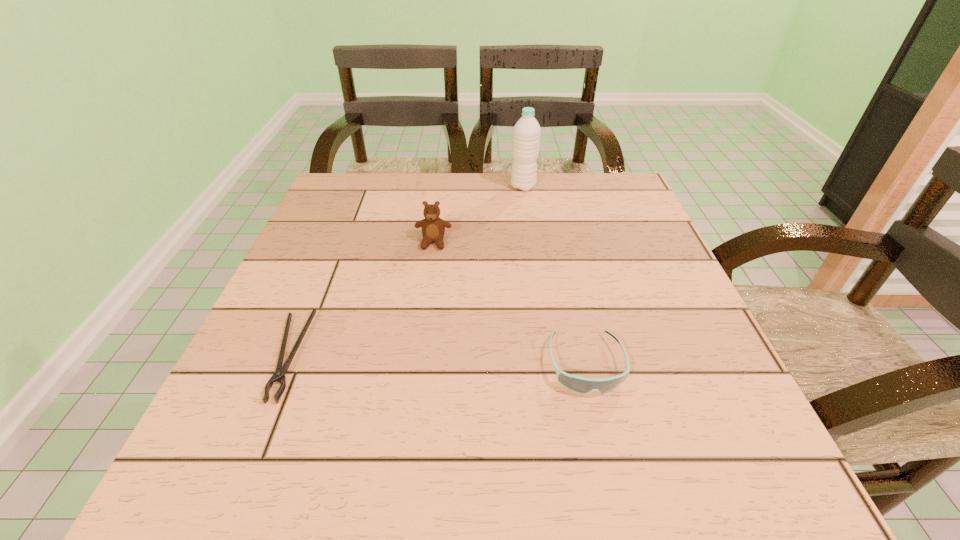
Image resolution: width=960 pixels, height=540 pixels. Find the location of `blank area located 0.360m on the right of the shortest object`. blank area located 0.360m on the right of the shortest object is located at coordinates (512, 356).

Where is `object present at the far edge`? This screenshot has width=960, height=540. object present at the far edge is located at coordinates (526, 137).

Locate an element on the screen. object that is at the left edge is located at coordinates coord(279,375).

Identify the location of free space at the far edge of the desktop. (440, 187).

Find the location of a particular element. Image resolution: width=960 pixels, height=540 pixels. vacant region at the near edge of the desktop is located at coordinates (653, 497).

The height and width of the screenshot is (540, 960). In the image, there is a desktop. Identify the location of vacant space at the left edge. (275, 292).

This screenshot has width=960, height=540. I want to click on free space at the right edge of the desktop, so click(611, 303).

In order to click on vacant space at the far left corner in this screenshot , I will do 384,193.

I want to click on free space at the far right corner, so click(x=588, y=187).

At what (x,y) coordinates should I click in order to perform the action: click on unoccupied position between the third shortest object and the goggles. Please return your answer as a coordinate pair (x, y). The width and height of the screenshot is (960, 540). Looking at the image, I should click on (510, 303).